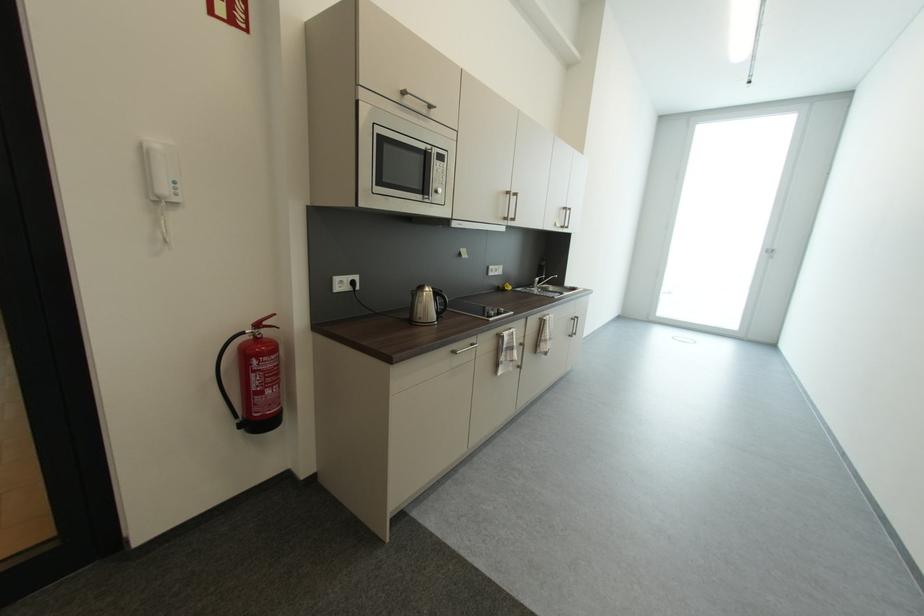
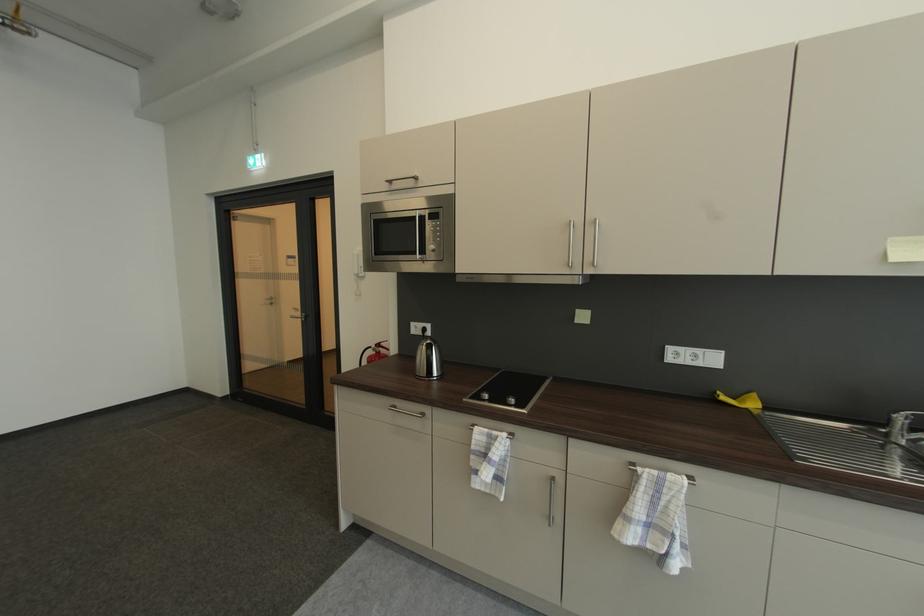
Locate, in the second image, the point that corresponds to pixel 538 288 in the first image.

(892, 432)